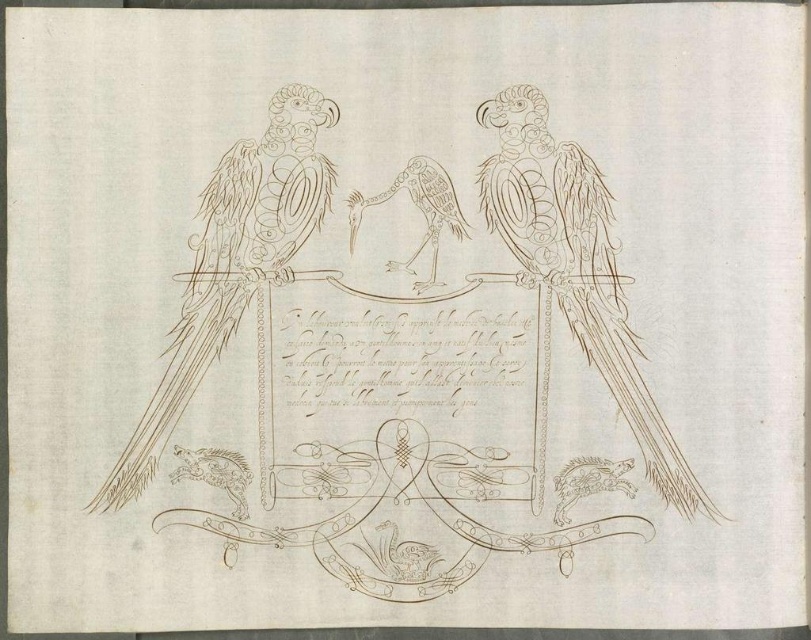
Is brown textured parrot at center to the left of smooth brown parrot at center from the viewer's perspective?

No, brown textured parrot at center is not to the left of smooth brown parrot at center.

Based on the photo, is brown textured parrot at center above smooth brown parrot at center?

Actually, brown textured parrot at center is below smooth brown parrot at center.

This screenshot has height=640, width=811. Describe the element at coordinates (576, 268) in the screenshot. I see `brown textured parrot at center` at that location.

You are a GUI agent. You are given a task and a screenshot of the screen. Output one action in this format:
    pyautogui.click(x=<x>, y=<y>)
    Task: Click on the brown textured parrot at center
    The image size is (811, 640).
    Given the screenshot: What is the action you would take?
    pyautogui.click(x=576, y=268)

How much distance is there between brown textured parrot at center and brown line art parrot at left?

brown textured parrot at center and brown line art parrot at left are 11.41 inches apart.

Consider the image. Can you confirm if brown textured parrot at center is positioned above brown line art parrot at left?

No, brown textured parrot at center is not above brown line art parrot at left.

Who is more forward, (504,108) or (254,260)?

Answer: Point (504,108) is in front.

The width and height of the screenshot is (811, 640). I want to click on brown textured parrot at center, so click(x=576, y=268).

Can you confirm if brown line art parrot at left is positioned to the right of smooth brown parrot at center?

No, brown line art parrot at left is not to the right of smooth brown parrot at center.

Who is shorter, brown line art parrot at left or smooth brown parrot at center?

smooth brown parrot at center is shorter.

Does point (254, 282) come in front of point (443, 196)?

That is False.

Where is `brown line art parrot at left`? Image resolution: width=811 pixels, height=640 pixels. brown line art parrot at left is located at coordinates (234, 262).